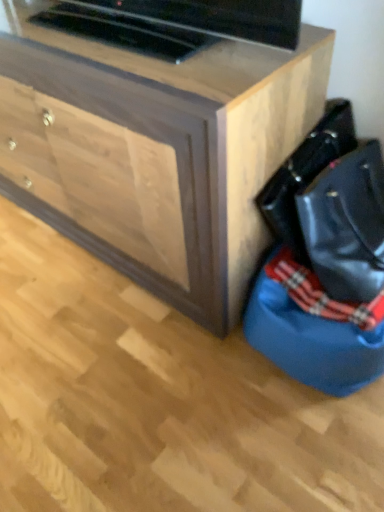
Locate an element on the screen. The height and width of the screenshot is (512, 384). wooden chest of drawers at center is located at coordinates (154, 148).

Describe the element at coordinates (320, 294) in the screenshot. I see `blue satin blanket at lower right` at that location.

Measure the distance between point [295,362] and camera.

Point [295,362] is 3.91 feet from camera.

Where is `blue fabric bean bag at lower right`? The image size is (384, 512). blue fabric bean bag at lower right is located at coordinates (313, 329).

Locate an element on the screen. Image resolution: width=384 pixels, height=512 pixels. wooden chest of drawers at center is located at coordinates (154, 148).

Where is `blanket on the left of blue fabric bean bag at lower right`? blanket on the left of blue fabric bean bag at lower right is located at coordinates (320, 294).

From a real-world perspective, is blue satin blanket at lower right positioned above or below blue fabric bean bag at lower right?

From a real-world perspective, blue satin blanket at lower right is physically above blue fabric bean bag at lower right.

Relative to blue fabric bean bag at lower right, is blue satin blanket at lower right in front or behind?

blue satin blanket at lower right is positioned farther from the viewer than blue fabric bean bag at lower right.

From the image's perspective, is blue satin blanket at lower right under blue fabric bean bag at lower right?

No, from the image's perspective, blue satin blanket at lower right is not below blue fabric bean bag at lower right.

Is black leather messenger bag at lower right next to wooden chest of drawers at center and touching it?

No, black leather messenger bag at lower right is not next to wooden chest of drawers at center.

Considering the relative sizes of black leather messenger bag at lower right and wooden chest of drawers at center in the image provided, is black leather messenger bag at lower right taller than wooden chest of drawers at center?

No, black leather messenger bag at lower right is not taller than wooden chest of drawers at center.

From a real-world perspective, which object rests below the other?

From a 3D spatial view, wooden chest of drawers at center is below.

Is black leather messenger bag at lower right bigger than wooden chest of drawers at center?

No, black leather messenger bag at lower right is not bigger than wooden chest of drawers at center.

I want to click on messenger bag located above the blue satin blanket at lower right (from a real-world perspective), so click(306, 173).

Would you say black leather messenger bag at lower right contains blue satin blanket at lower right?

No, black leather messenger bag at lower right does not contain blue satin blanket at lower right.

Between black leather messenger bag at lower right and blue satin blanket at lower right, which one is positioned in front?

black leather messenger bag at lower right is in front.

Which is more distant, [276,237] or [369,328]?

The point [276,237] is farther.

From the image's perspective, is wooden chest of drawers at center located above blue satin blanket at lower right?

Yes, from the image's perspective, wooden chest of drawers at center is on top of blue satin blanket at lower right.

Are wooden chest of drawers at center and blue satin blanket at lower right located far from each other?

wooden chest of drawers at center is actually quite close to blue satin blanket at lower right.

Based on the photo, is wooden chest of drawers at center wider or thinner than blue satin blanket at lower right?

Considering their sizes, wooden chest of drawers at center looks broader than blue satin blanket at lower right.

Which of these two, blue satin blanket at lower right or wooden chest of drawers at center, is smaller?

Smaller between the two is blue satin blanket at lower right.

Is blue satin blanket at lower right facing away from wooden chest of drawers at center?

No.

Is blue satin blanket at lower right wider than wooden chest of drawers at center?

Incorrect, the width of blue satin blanket at lower right does not surpass that of wooden chest of drawers at center.

From a real-world perspective, is blue satin blanket at lower right over wooden chest of drawers at center?

No.

From the picture: How many degrees apart are the facing directions of blue fabric bean bag at lower right and wooden chest of drawers at center?

They differ by 0.000207 degrees in their facing directions.

Identify the location of bean bag chair below the wooden chest of drawers at center (from the image's perspective). (313, 329).

Is blue fabric bean bag at lower right oriented towards wooden chest of drawers at center?

No, blue fabric bean bag at lower right is not oriented towards wooden chest of drawers at center.

Between blue fabric bean bag at lower right and wooden chest of drawers at center, which one appears on the left side from the viewer's perspective?

wooden chest of drawers at center.

Which of these two, wooden chest of drawers at center or black leather messenger bag at lower right, stands shorter?

Standing shorter between the two is black leather messenger bag at lower right.

From a real-world perspective, is wooden chest of drawers at center below black leather messenger bag at lower right?

Yes, from a real-world perspective, wooden chest of drawers at center is under black leather messenger bag at lower right.

Does point (70, 14) lie in front of point (335, 132)?

Yes, it is in front of point (335, 132).

From the image's perspective, which is above, wooden chest of drawers at center or black leather messenger bag at lower right?

wooden chest of drawers at center is shown above in the image.

Find the location of a particular element. blanket behind the blue fabric bean bag at lower right is located at coordinates [320, 294].

The width and height of the screenshot is (384, 512). In order to click on the chest of drawers above the black leather messenger bag at lower right (from the image's perspective) in this screenshot , I will do point(154,148).

Estimate the real-world distances between objects in this image. Which object is closer to wooden chest of drawers at center, blue satin blanket at lower right or black leather messenger bag at lower right?

black leather messenger bag at lower right is closer to wooden chest of drawers at center.

From the image, which object appears to be farther from wooden chest of drawers at center, blue fabric bean bag at lower right or black leather messenger bag at lower right?

blue fabric bean bag at lower right is positioned further to the anchor wooden chest of drawers at center.

From the image, which object appears to be nearer to blue fabric bean bag at lower right, wooden chest of drawers at center or blue satin blanket at lower right?

The object closer to blue fabric bean bag at lower right is blue satin blanket at lower right.

Based on the photo, based on their spatial positions, is wooden chest of drawers at center or blue fabric bean bag at lower right further from blue satin blanket at lower right?

wooden chest of drawers at center is positioned further to the anchor blue satin blanket at lower right.

Based on their spatial positions, is wooden chest of drawers at center or black leather messenger bag at lower right closer to blue satin blanket at lower right?

The object closer to blue satin blanket at lower right is black leather messenger bag at lower right.

When comparing their distances from black leather messenger bag at lower right, does wooden chest of drawers at center or blue fabric bean bag at lower right seem further?

wooden chest of drawers at center is further to black leather messenger bag at lower right.

Looking at the image, which one is located further to black leather messenger bag at lower right, wooden chest of drawers at center or blue satin blanket at lower right?

Based on the image, wooden chest of drawers at center appears to be further to black leather messenger bag at lower right.

Based on their spatial positions, is blue fabric bean bag at lower right or wooden chest of drawers at center further from blue satin blanket at lower right?

Based on the image, wooden chest of drawers at center appears to be further to blue satin blanket at lower right.

Where is `blanket that lies between black leather messenger bag at lower right and blue fabric bean bag at lower right from top to bottom`? The image size is (384, 512). blanket that lies between black leather messenger bag at lower right and blue fabric bean bag at lower right from top to bottom is located at coordinates (320, 294).

The width and height of the screenshot is (384, 512). I want to click on messenger bag situated between wooden chest of drawers at center and blue satin blanket at lower right from left to right, so click(x=306, y=173).

Find the location of `blanket between wooden chest of drawers at center and blue fabric bean bag at lower right from left to right`. blanket between wooden chest of drawers at center and blue fabric bean bag at lower right from left to right is located at coordinates (320, 294).

Identify the location of messenger bag between wooden chest of drawers at center and blue fabric bean bag at lower right in the horizontal direction. (306, 173).